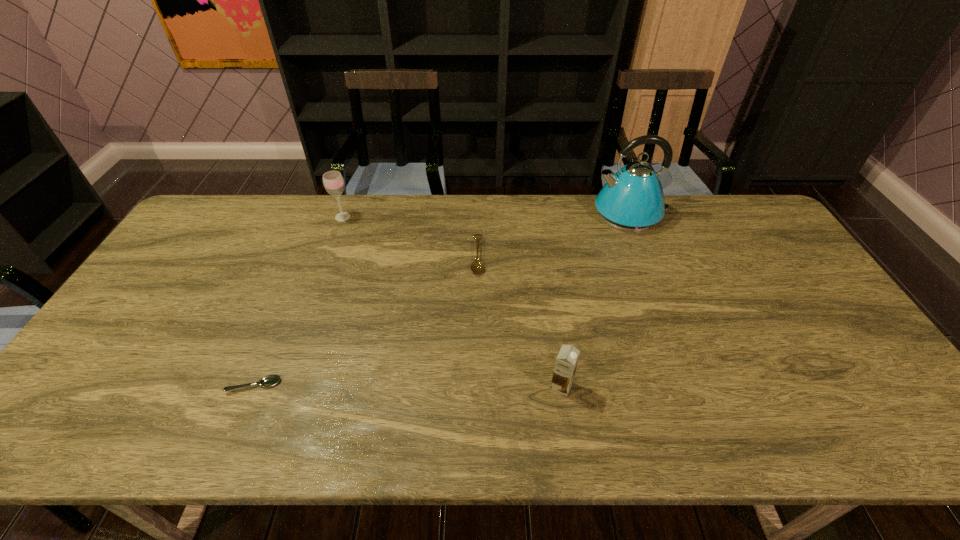
Find the location of a particular element. the tallest object is located at coordinates (632, 200).

Identify the location of the rightmost object. This screenshot has width=960, height=540. (632, 200).

Find the location of a particular element. The width and height of the screenshot is (960, 540). wineglass is located at coordinates (333, 182).

You are a GUI agent. You are given a task and a screenshot of the screen. Output one action in this format:
    pyautogui.click(x=<x>, y=<y>)
    Task: Click on the third shortest object
    This screenshot has height=540, width=960.
    Given the screenshot: What is the action you would take?
    [x=566, y=362]

This screenshot has height=540, width=960. In order to click on the fourth object from left to right in this screenshot , I will do `click(566, 362)`.

What are the coordinates of `ladle` in the screenshot? It's located at (477, 267).

Locate an element on the screen. Image resolution: width=960 pixels, height=540 pixels. the fourth tallest object is located at coordinates (477, 267).

What are the coordinates of `soupspoon` in the screenshot? It's located at (270, 380).

Find the location of `free spot located at the spout of the rightmost object`. free spot located at the spout of the rightmost object is located at coordinates (555, 214).

Where is `free spot located at the spout of the rightmost object`? This screenshot has width=960, height=540. free spot located at the spout of the rightmost object is located at coordinates (555, 214).